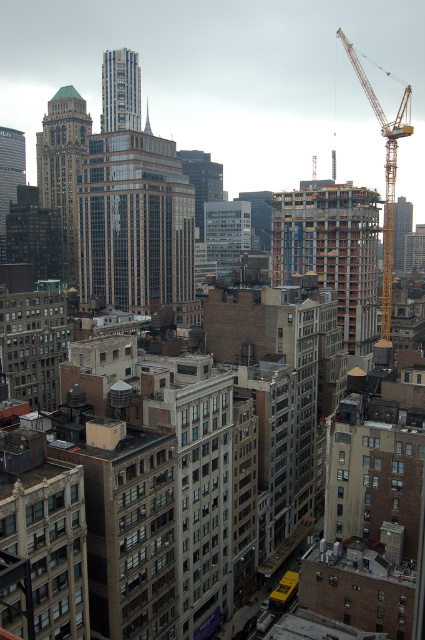
Does glassy reflective skyscraper at center have a larger size compared to gold/brass/textured building at center?

Yes.

Is glassy reflective skyscraper at center wider than gold/brass/textured building at center?

Yes.

Identify the location of glassy reflective skyscraper at center. (133, 224).

Does point (345, 314) come closer to viewer compared to point (78, 144)?

Yes, it is.

In the scene shown: Who is shorter, red brick construction at center or gold/brass/textured building at center?

red brick construction at center

Which is in front, point (359, 221) or point (65, 144)?

Point (359, 221)

Image resolution: width=425 pixels, height=640 pixels. Find the location of `red brick construction at center`. red brick construction at center is located at coordinates (331, 250).

Between gold/brass/textured building at center and yellow metallic crane at right, which one has less height?

Standing shorter between the two is gold/brass/textured building at center.

Is point (70, 275) less distant than point (385, 228)?

No, it is not.

Find the location of `gold/brass/textured building at center`. gold/brass/textured building at center is located at coordinates (62, 168).